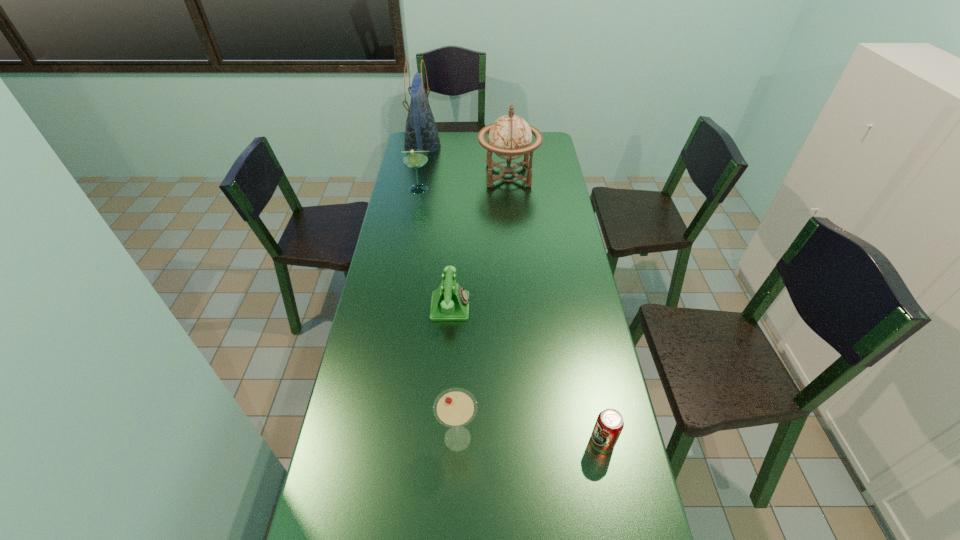
In order to click on vacant space that satisfies the following two spatial constraints: 1. on the dial of the telephone; 2. on the right side of the nearer martini in this screenshot , I will do `click(443, 438)`.